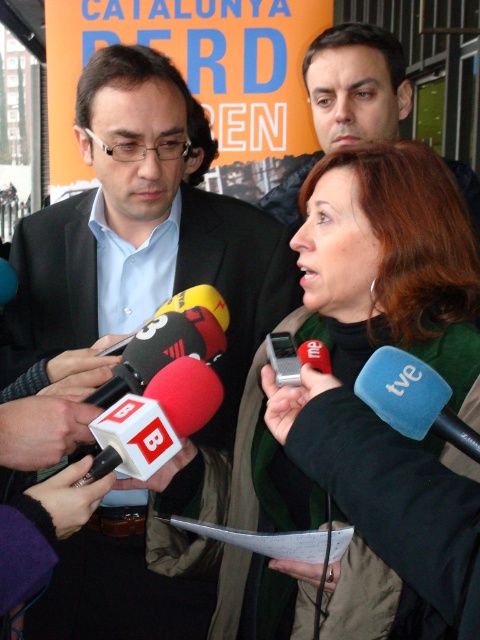
Can you confirm if green wool scarf at center is positioned above blue rubber microphone at center?

No.

Who is taller, green wool scarf at center or blue rubber microphone at center?

Standing taller between the two is green wool scarf at center.

Between point (183, 506) and point (404, 356), which one is positioned behind?

The point (183, 506) is behind.

The height and width of the screenshot is (640, 480). I want to click on green wool scarf at center, so click(387, 262).

Is green wool scarf at center to the left of matte black jacket at upper center from the viewer's perspective?

Yes, green wool scarf at center is to the left of matte black jacket at upper center.

Image resolution: width=480 pixels, height=640 pixels. Find the location of `green wool scarf at center`. green wool scarf at center is located at coordinates (387, 262).

Which is behind, point (456, 390) or point (356, 67)?

Point (356, 67)

Identify the location of green wool scarf at center. (387, 262).

Can you confirm if matte black suit at center is bigger than matte black jacket at upper center?

No, matte black suit at center is not bigger than matte black jacket at upper center.

Can you confirm if matte black suit at center is taller than matte black jacket at upper center?

Correct, matte black suit at center is much taller as matte black jacket at upper center.

Locate an element on the screen. This screenshot has height=640, width=480. matte black suit at center is located at coordinates pyautogui.click(x=144, y=230).